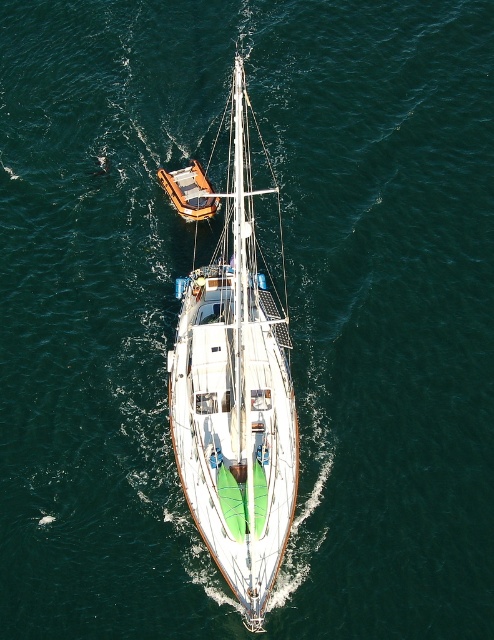
Question: Can you confirm if white glossy sailboat at center is bigger than orange matte dinghy at upper center?

Choices:
 (A) no
 (B) yes

Answer: (B)

Question: Which point appears closest to the camera in this image?

Choices:
 (A) pos(246,564)
 (B) pos(190,205)

Answer: (A)

Question: Does white glossy sailboat at center appear over orange matte dinghy at upper center?

Choices:
 (A) yes
 (B) no

Answer: (A)

Question: Can you confirm if white glossy sailboat at center is positioned to the right of orange matte dinghy at upper center?

Choices:
 (A) no
 (B) yes

Answer: (B)